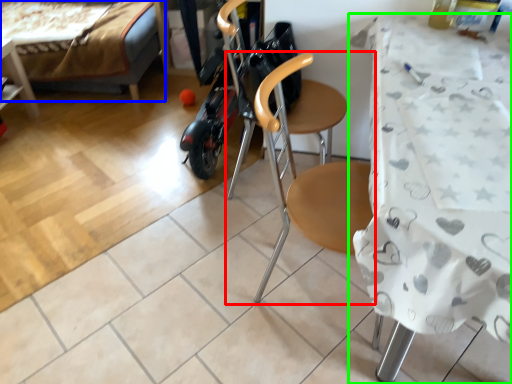
Question: Based on their relative distances, which object is farther from chair (highlighted by a red box)? Choose from bed (highlighted by a blue box) and table (highlighted by a green box).

Choices:
 (A) bed
 (B) table

Answer: (A)